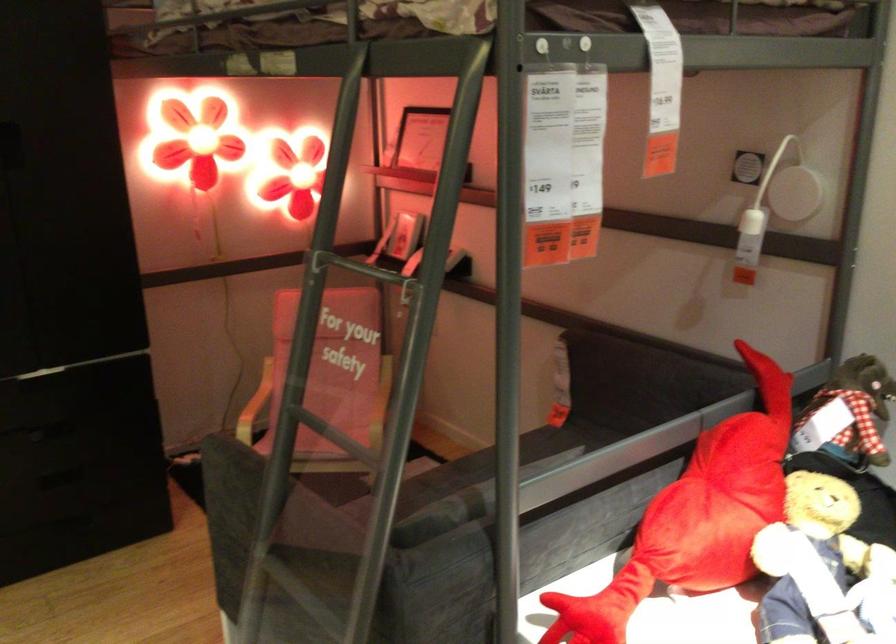
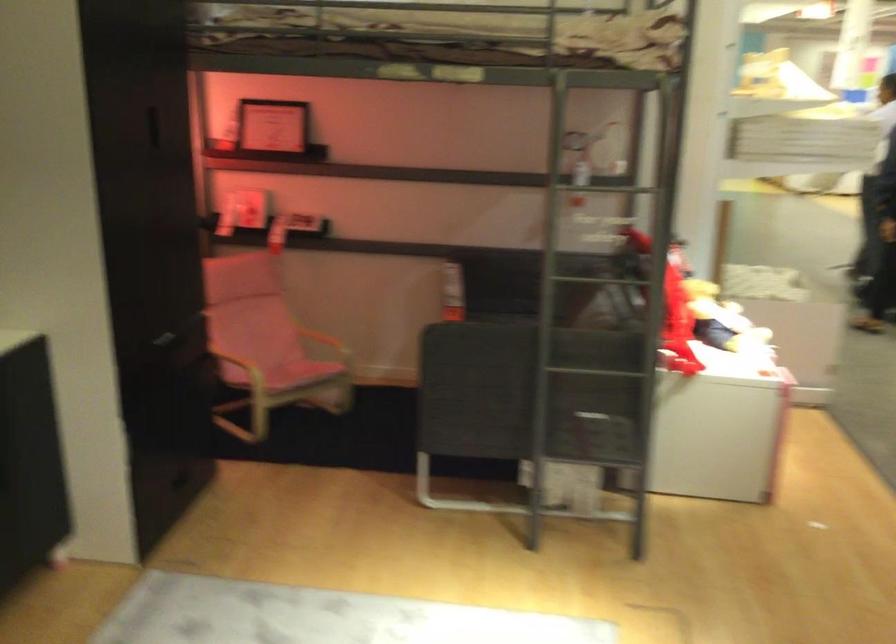
Question: I am providing you with two images of the same scene from different viewpoints. Which of the following objects are not visible in image2?

Choices:
 (A) cabinet slot handle
 (B) yellow bucket handle
 (C) black drawer handle
 (D) black framed picture

Answer: (C)